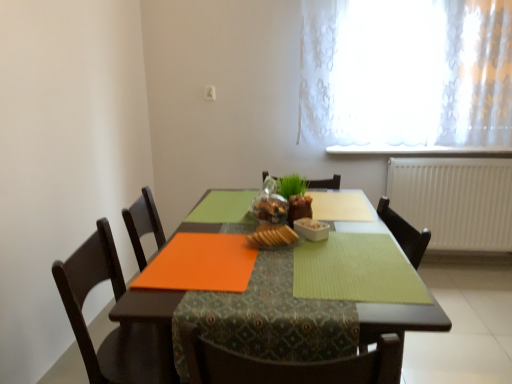
Where is `blank space situated above green textured placemat at center, which ranks as the first place mat in right-to-left order (from a real-world perspective)`? blank space situated above green textured placemat at center, which ranks as the first place mat in right-to-left order (from a real-world perspective) is located at coordinates (353, 258).